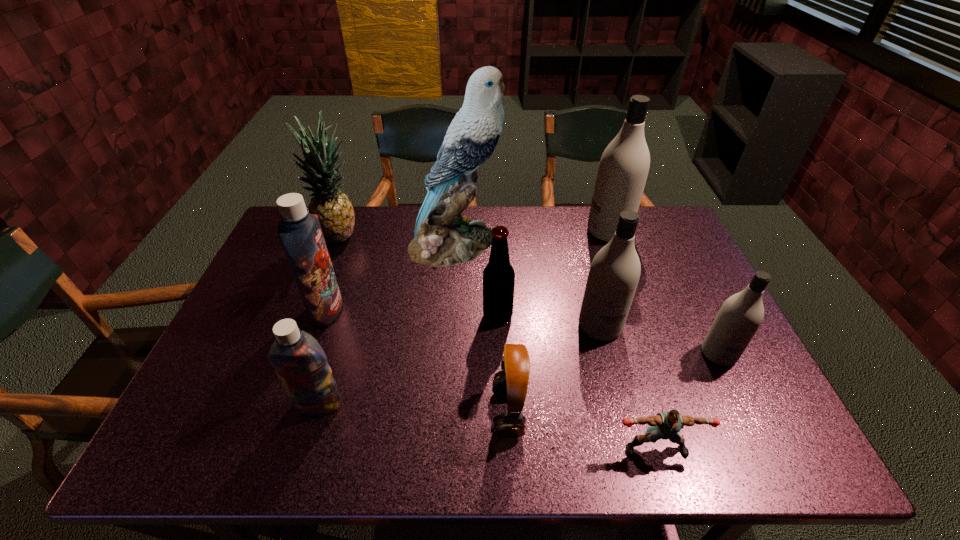
You are a GUI agent. You are given a task and a screenshot of the screen. Output one action in this format:
    pyautogui.click(x=<x>, y=<y>)
    Task: Click on the parakeet
    
    Given the screenshot: What is the action you would take?
    pyautogui.click(x=443, y=237)

The width and height of the screenshot is (960, 540). I want to click on the farthest white shampoo, so click(624, 165).

The image size is (960, 540). What are the coordinates of `the biggest white shampoo` in the screenshot? It's located at (624, 165).

Where is `yellow pineapple`? This screenshot has height=540, width=960. yellow pineapple is located at coordinates (335, 212).

Identify the location of the farther blue shampoo. (300, 233).

Identify the location of the second biggest white shampoo. This screenshot has width=960, height=540. (614, 273).

Locate an element on the screen. This screenshot has width=960, height=540. beer bottle is located at coordinates (498, 276).

At what (x,y) coordinates should I click in order to perform the action: click on the nearer blue shampoo. Please return your answer as a coordinate pair (x, y). Looking at the image, I should click on (299, 361).

The width and height of the screenshot is (960, 540). In order to click on the smaller blue shampoo in this screenshot , I will do `click(299, 361)`.

You are a GUI agent. You are given a task and a screenshot of the screen. Output one action in this format:
    pyautogui.click(x=<x>, y=<y>)
    Task: Click on the rightmost shampoo
    
    Given the screenshot: What is the action you would take?
    pyautogui.click(x=740, y=316)